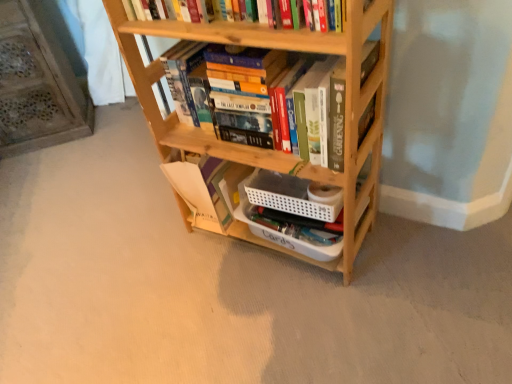
Locate an element on the screen. The width and height of the screenshot is (512, 384). vacant area located to the right-hand side of wooden bookshelf at left is located at coordinates click(114, 137).